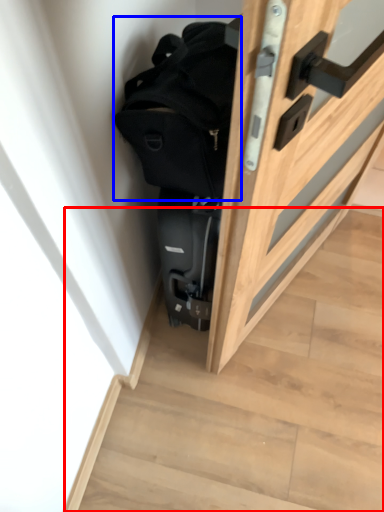
Question: Which object is further to the camera taking this photo, stairwell (highlighted by a red box) or backpack (highlighted by a blue box)?

Choices:
 (A) stairwell
 (B) backpack

Answer: (A)